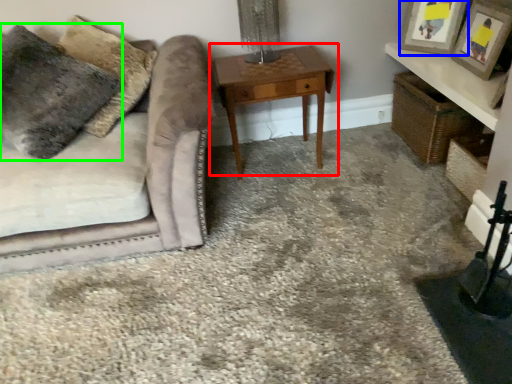
Question: Estimate the real-world distances between objects in this image. Which object is farther from table (highlighted by a red box), picture frame (highlighted by a blue box) or pillow (highlighted by a green box)?

Choices:
 (A) picture frame
 (B) pillow

Answer: (B)